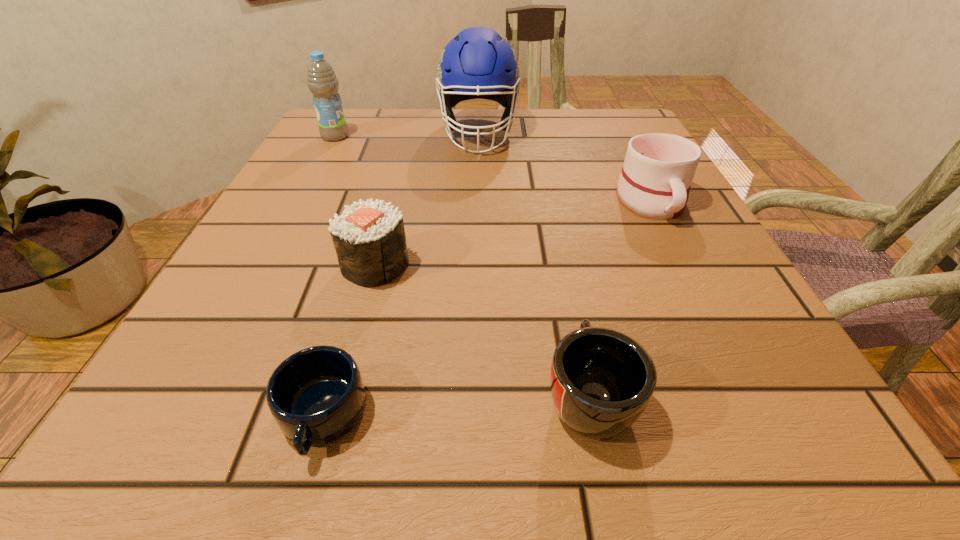
This screenshot has height=540, width=960. What are the coordinates of `free spot located 0.070m on the back of the second tallest object` in the screenshot? It's located at (346, 118).

Locate an element on the screen. The image size is (960, 540). blank space located 0.070m on the side with the handle of the rightmost mug is located at coordinates (679, 254).

Locate an element on the screen. This screenshot has width=960, height=540. vacant space located 0.090m on the left of the sushi is located at coordinates (285, 265).

Identify the location of vacant area situated 0.290m on the side of the second tallest mug with the handle. (552, 219).

Find the location of `vacant space positioned on the side of the second tallest mug with the handle`. vacant space positioned on the side of the second tallest mug with the handle is located at coordinates (553, 225).

This screenshot has width=960, height=540. Identify the location of blank space located on the side of the second tallest mug with the handle. (548, 200).

Image resolution: width=960 pixels, height=540 pixels. Find the location of `football helmet present at the far edge`. football helmet present at the far edge is located at coordinates (478, 63).

What are the coordinates of `water bottle situated at the far edge` in the screenshot? It's located at (322, 81).

You are a GUI agent. You are given a task and a screenshot of the screen. Output one action in this format:
    pyautogui.click(x=<x>, y=<y>)
    Task: Click on the object located in the left edge section of the desktop
    This screenshot has width=960, height=540.
    Given the screenshot: What is the action you would take?
    pyautogui.click(x=322, y=81)

In order to click on object located at the right edge in this screenshot , I will do `click(658, 170)`.